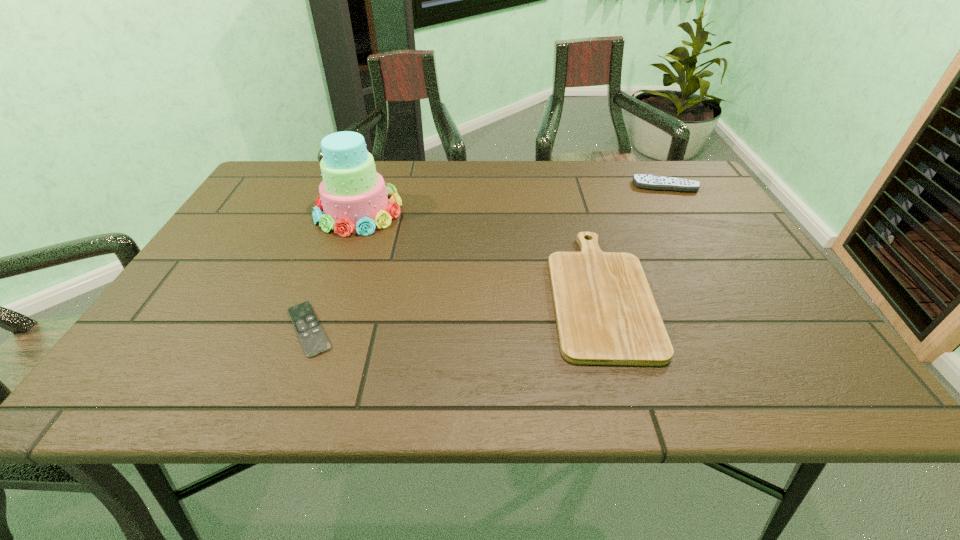
Where is `vacant space at the far left corner of the desktop`? The height and width of the screenshot is (540, 960). vacant space at the far left corner of the desktop is located at coordinates (261, 186).

In the image, there is a desktop. Where is `vacant space at the far right corner`? This screenshot has height=540, width=960. vacant space at the far right corner is located at coordinates (690, 195).

The image size is (960, 540). In the image, there is a desktop. In order to click on vacant region at the near right corner in this screenshot , I will do `click(780, 389)`.

Where is `free space between the right remote control and the shorter remote control`? free space between the right remote control and the shorter remote control is located at coordinates (487, 258).

In order to click on free space between the rightmost object and the tallest object in this screenshot , I will do `click(512, 199)`.

Where is `vacant area that lies between the chopping board and the left remote control`? vacant area that lies between the chopping board and the left remote control is located at coordinates (454, 310).

This screenshot has height=540, width=960. Find the location of `unoccupied position between the third tallest object and the rightmost object`. unoccupied position between the third tallest object and the rightmost object is located at coordinates (633, 239).

I want to click on blank region between the rightmost object and the shorter remote control, so click(x=487, y=258).

Where is `free space between the second shortest object and the cake`? This screenshot has width=960, height=540. free space between the second shortest object and the cake is located at coordinates (479, 251).

The width and height of the screenshot is (960, 540). Identify the location of vacant space in between the third tallest object and the cake. (479, 251).